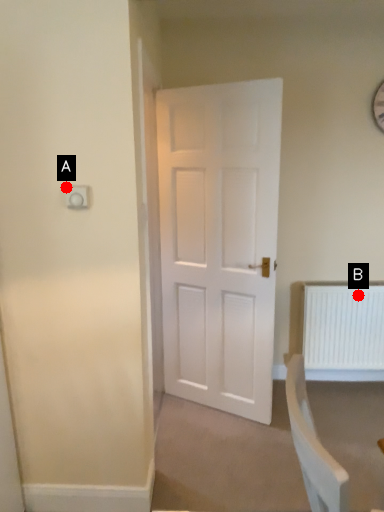
Question: Two points are circled on the image, labeled by A and B beside each circle. Which point is further to the camera?

Choices:
 (A) A is further
 (B) B is further

Answer: (B)